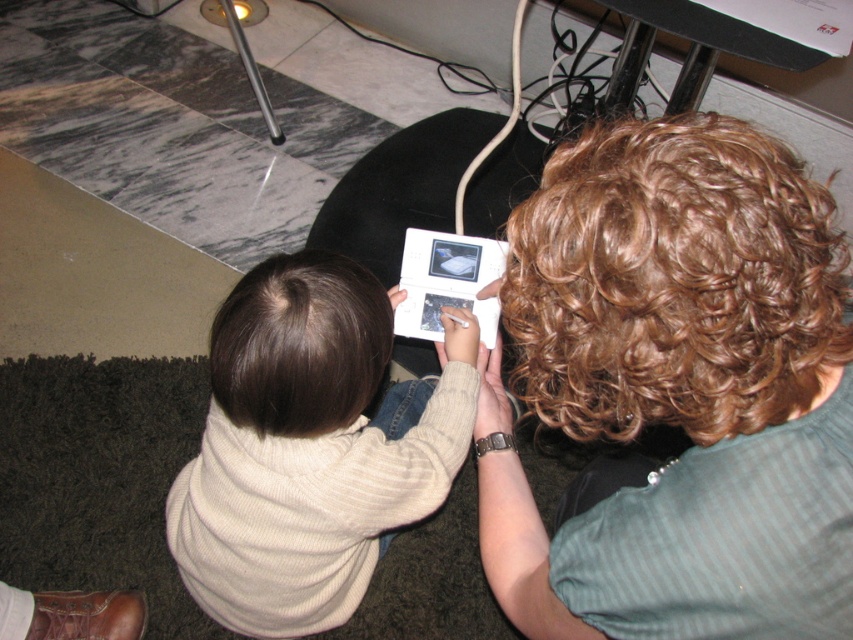
Is point (741, 518) closer to viewer compared to point (175, 516)?

Yes, point (741, 518) is closer to viewer.

Does curly brown hair at upper right appear under creamy wool sweater at lower left?

Actually, curly brown hair at upper right is above creamy wool sweater at lower left.

This screenshot has width=853, height=640. Identify the location of curly brown hair at upper right. (677, 384).

Between point (312, 632) and point (486, 326), which one is positioned in front?

Point (312, 632)

Is creamy wool sweater at lower left closer to the viewer compared to white glossy ipod at center?

Yes.

Measure the distance between point (235, 451) and camera.

They are 35.14 inches apart.

You are a GUI agent. You are given a task and a screenshot of the screen. Output one action in this format:
    pyautogui.click(x=<x>, y=<y>)
    Task: Click on the creamy wool sweater at lower left
    The image size is (853, 640).
    Given the screenshot: What is the action you would take?
    pyautogui.click(x=308, y=449)

Measure the distance between point [547,577] and camera.

Point [547,577] and camera are 26.79 inches apart from each other.

Which is above, curly brown hair at upper right or white glossy ipod at center?

white glossy ipod at center is higher up.

Which is behind, point (660, 122) or point (419, 228)?

Positioned behind is point (419, 228).

Locate an element on the screen. This screenshot has width=853, height=640. curly brown hair at upper right is located at coordinates (677, 384).